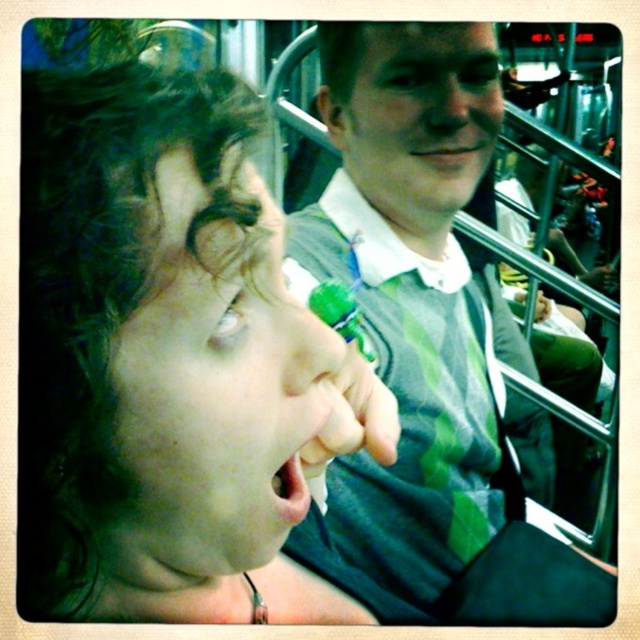
You are a passenger on a bus and you have a matte green bottle at center and a green striped shirt at center in your view. Which object is closer to you?

The matte green bottle at center is closer to you because it is in front of the green striped shirt at center.

You are a passenger on a bus and you see a matte green bottle at center. You want to grab it quickly before the bus stops. Can you reach it without moving from your seat?

The matte green bottle at center is 9.82 inches from viewer, so yes, you can reach it easily from your seat since it is within arm reach.

You are a passenger on a bus and see a matte green bottle at center and a green striped shirt at center. Which object is positioned to the left?

The matte green bottle at center is to the left of the green striped shirt at center.